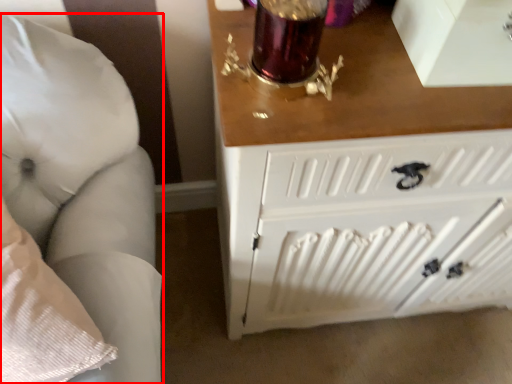
Question: From the image, what is the correct spatial relationship of furniture (annotated by the red box) in relation to radiator?

Choices:
 (A) left
 (B) right

Answer: (A)